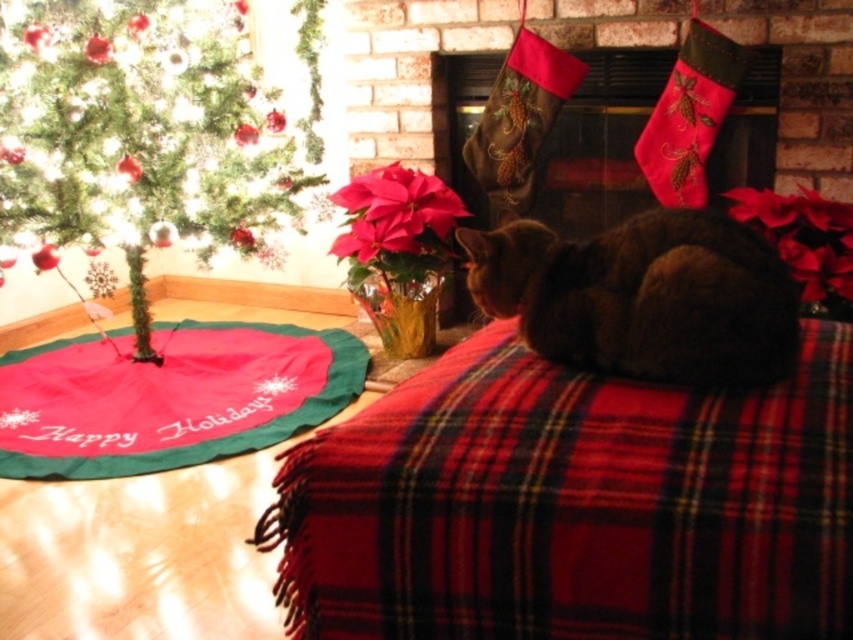
You are standing in the room and want to reach the green matte christmas tree at lower left. If you are 1.85 meters away from it, can you comfortably extend your arm to touch it without moving your feet?

The distance between you and the green matte christmas tree at lower left is 1.85 meters. Since the average arm length is about 0.7 meters, you cannot comfortably reach it without moving closer.

You are standing in the room and want to place a gift under the Christmas tree. The red plaid blanket at center is located at point (573, 504). Can you estimate whether the gift will fit under the tree if it requires 0.8 units of space?

The red plaid blanket at center is located at point (573, 504). Since the gift requires 0.8 units of space, and the blanket is at 0.789 which is less than 0.8, there might be enough space. However, exact placement depends on the tree and blanket dimensions not provided here.